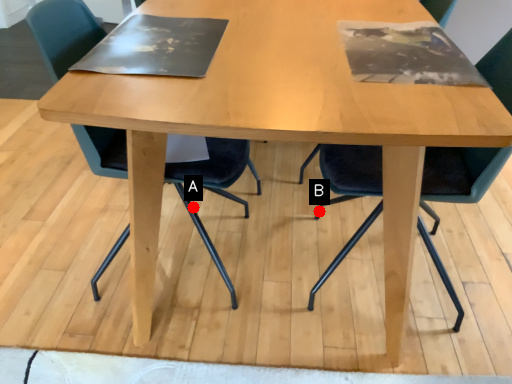
Question: Two points are circled on the image, labeled by A and B beside each circle. Which point is further to the camera?

Choices:
 (A) A is further
 (B) B is further

Answer: (B)